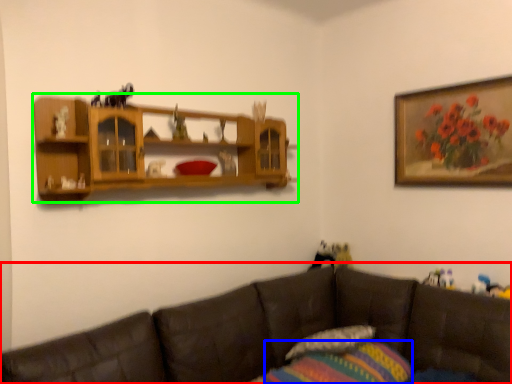
Question: Considering the real-world distances, which object is closest to studio couch (highlighted by a red box)? pillow (highlighted by a blue box) or shelf (highlighted by a green box).

Choices:
 (A) pillow
 (B) shelf

Answer: (A)